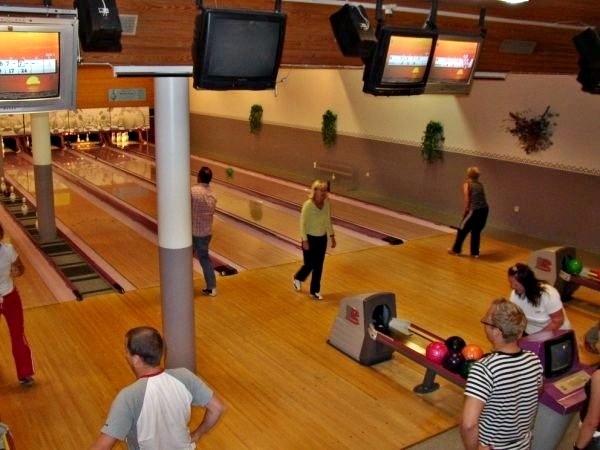
This screenshot has height=450, width=600. What are the coordinates of `displays` in the screenshot? It's located at (32, 62), (250, 45), (413, 64), (443, 67).